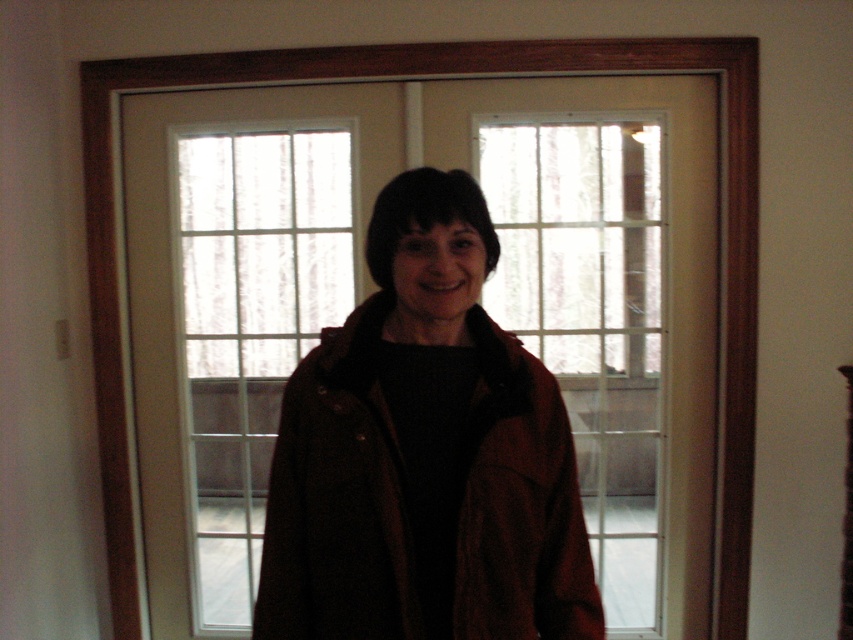
You are standing in the room and want to move from the point at coordinates point (303, 424) to the point at coordinates point (282, 365). Which direction should you move?

You should move backward because point (303, 424) is in front of point (282, 365), so moving backward will take you towards the latter point.